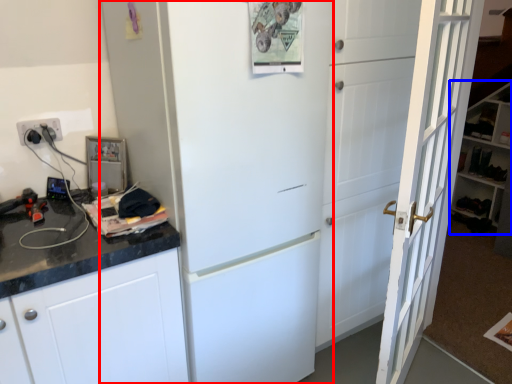
Question: Which of the following is the farthest to the observer, refrigerator (highlighted by a red box) or bookshelf (highlighted by a blue box)?

Choices:
 (A) refrigerator
 (B) bookshelf

Answer: (B)